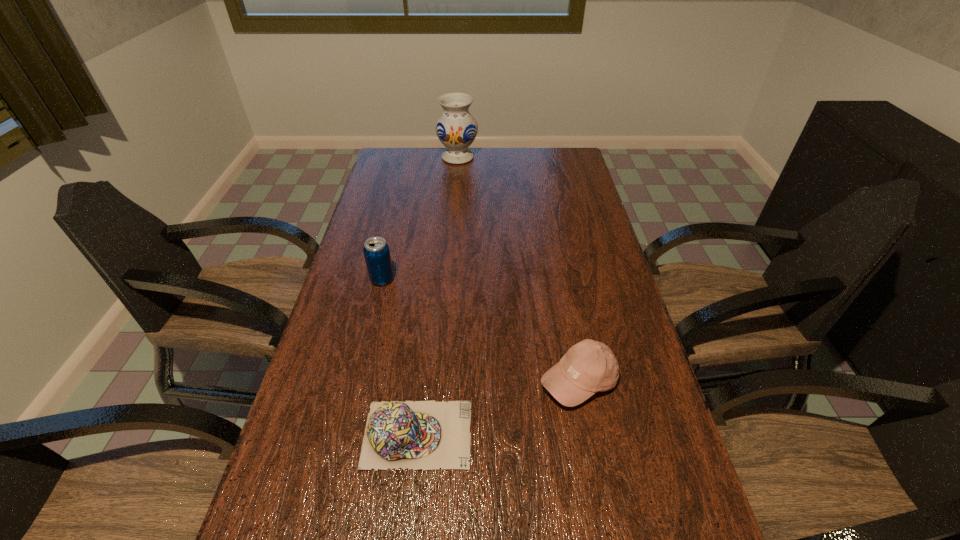
Identify the location of vase. (456, 128).

Locate an element on the screen. This screenshot has height=540, width=960. the farthest object is located at coordinates (456, 128).

Image resolution: width=960 pixels, height=540 pixels. I want to click on the leftmost object, so click(x=376, y=251).

Find the location of `the third shortest object`. the third shortest object is located at coordinates (376, 251).

Locate an element on the screen. This screenshot has width=960, height=540. baseball cap is located at coordinates (589, 366).

At what (x,y) coordinates should I click in order to perform the action: click on the second shortest object. Please return your answer as a coordinate pair (x, y). This screenshot has width=960, height=540. Looking at the image, I should click on (589, 366).

This screenshot has width=960, height=540. I want to click on cap, so click(x=427, y=435).

Where is `free region located 0.360m on the front of the farthest object`? free region located 0.360m on the front of the farthest object is located at coordinates (453, 219).

This screenshot has width=960, height=540. I want to click on free location located 0.260m on the back of the third nearest object, so click(x=396, y=220).

The image size is (960, 540). I want to click on vacant space located on the front-facing side of the baseball cap, so click(594, 461).